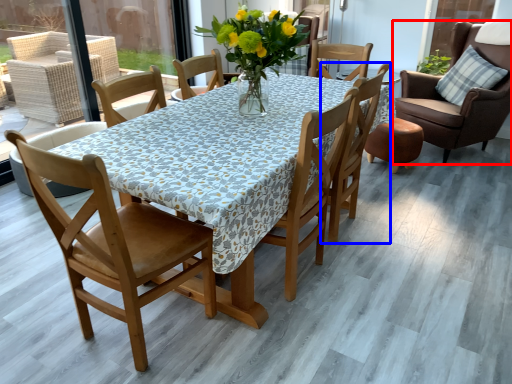
Question: Among these objects, which one is nearest to the camera, chair (highlighted by a red box) or chair (highlighted by a blue box)?

Choices:
 (A) chair
 (B) chair

Answer: (B)